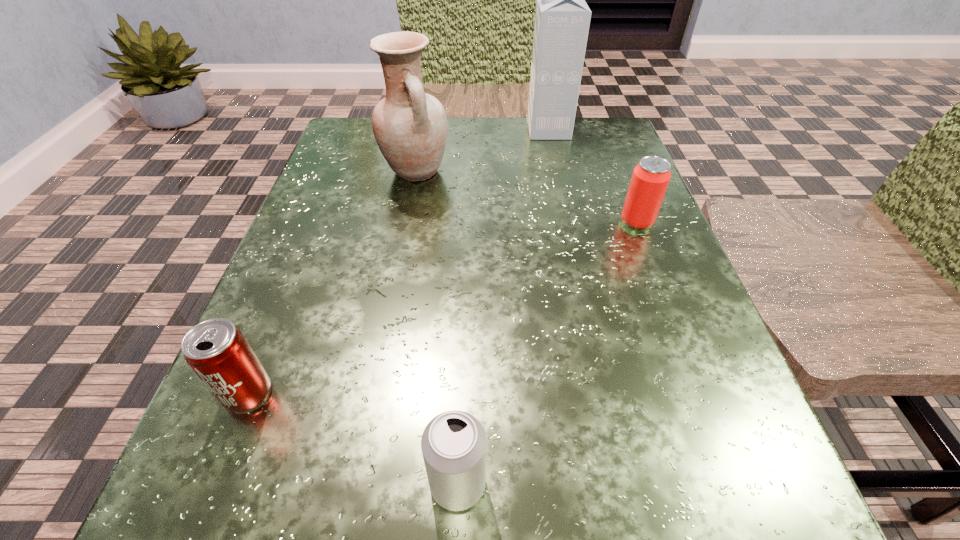
What are the coordinates of `the second object from right to left` in the screenshot? It's located at (562, 19).

At what (x,y) coordinates should I click in order to perform the action: click on carton. Please return your answer as a coordinate pair (x, y). This screenshot has width=960, height=540. Looking at the image, I should click on (562, 19).

Locate an element on the screen. The width and height of the screenshot is (960, 540). the fourth object from right to left is located at coordinates (410, 126).

Locate an element on the screen. This screenshot has height=540, width=960. pottery is located at coordinates (410, 126).

Where is `the third farthest object`? Image resolution: width=960 pixels, height=540 pixels. the third farthest object is located at coordinates (650, 178).

Where is `the farthest beer can`? The height and width of the screenshot is (540, 960). the farthest beer can is located at coordinates pyautogui.click(x=650, y=178).

This screenshot has width=960, height=540. Identify the location of the nearest object. (453, 444).

I want to click on the third object from right to left, so click(453, 444).

This screenshot has height=540, width=960. Identify the location of the second farthest beer can. (216, 350).

Where is `the leftmost object`? This screenshot has height=540, width=960. the leftmost object is located at coordinates (216, 350).